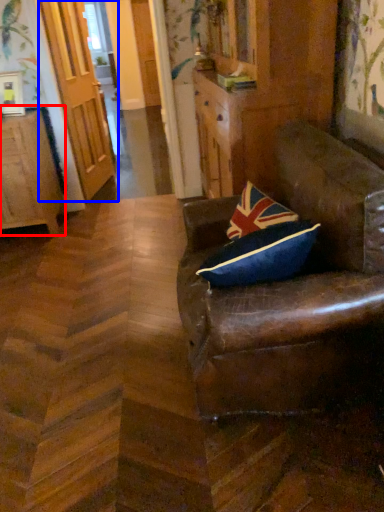
Question: Which object appears closest to the camera in this image, cabinetry (highlighted by a red box) or door (highlighted by a blue box)?

Choices:
 (A) cabinetry
 (B) door

Answer: (A)